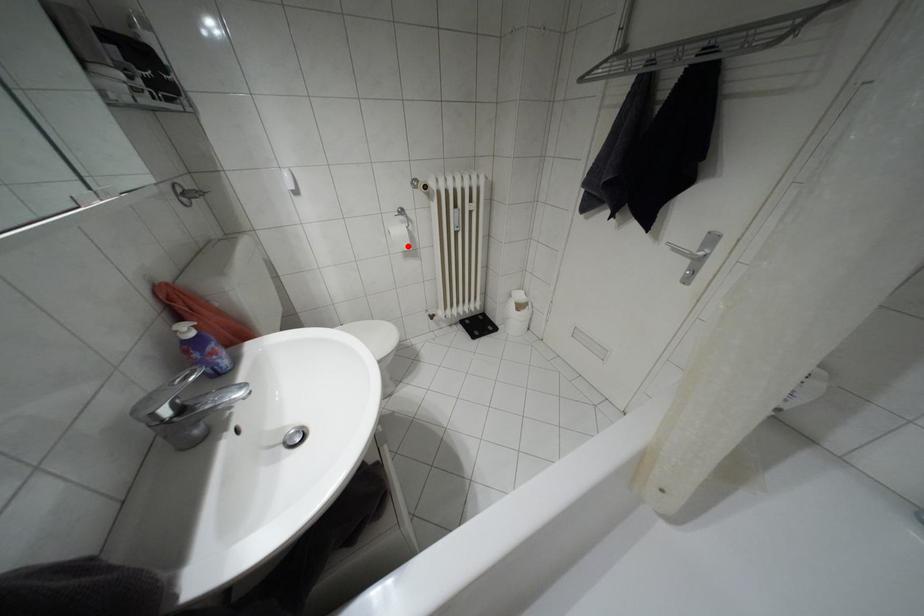
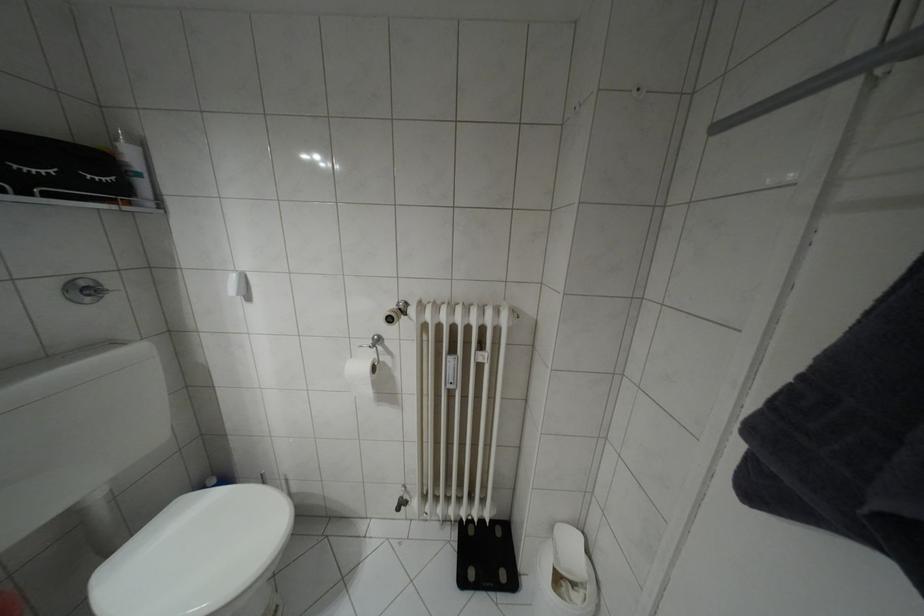
Question: I am providing you with two images of the same scene from different viewpoints. Image1 has a red point marked. In image2, the corresponding 3D location appears at what relative position? Reply with the corresponding letter.

Choices:
 (A) Closer
 (B) Farther

Answer: (B)